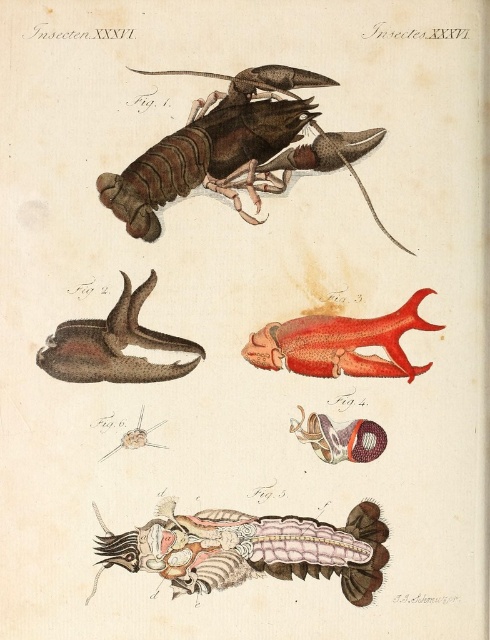
Image resolution: width=490 pixels, height=640 pixels. Find the location of `brown matte lobster at upper center`. brown matte lobster at upper center is located at coordinates (235, 148).

Which of these two, brown matte lobster at upper center or translucent pink exoskeleton at bottom center, stands taller?

brown matte lobster at upper center

This screenshot has height=640, width=490. I want to click on brown matte lobster at upper center, so click(235, 148).